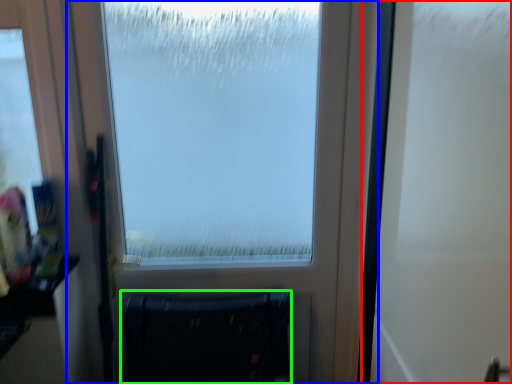
Question: Which object is the farthest from screen door (highlighted by a red box)? Choose among these: window (highlighted by a blue box) or furniture (highlighted by a green box).

Choices:
 (A) window
 (B) furniture

Answer: (B)